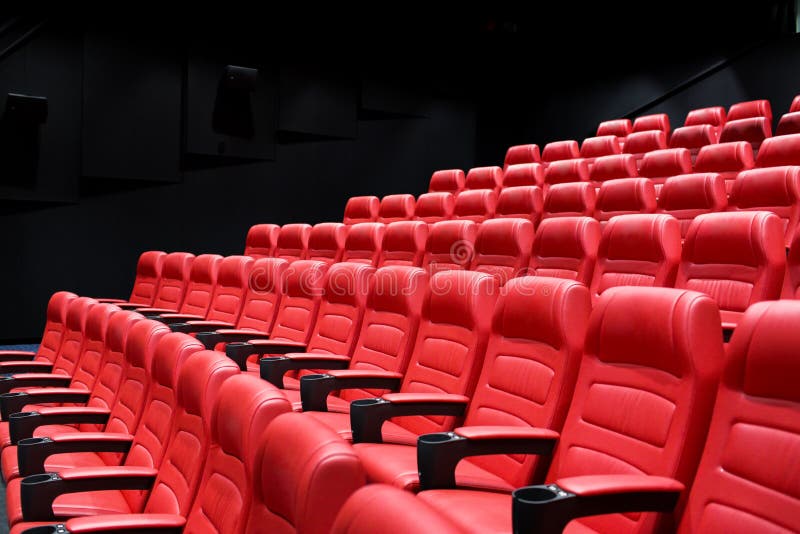
Locate an element on the screen. theater seat in fourth row is located at coordinates (766, 183), (681, 192), (630, 195), (574, 195), (525, 204), (474, 202), (434, 204), (388, 202), (362, 202).